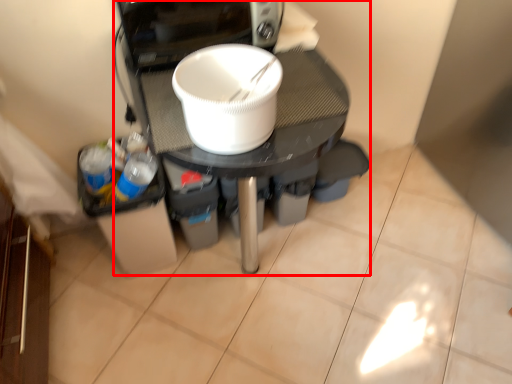
Question: Observing the image, what is the correct spatial positioning of appliance (annotated by the red box) in reference to tableware?

Choices:
 (A) left
 (B) right

Answer: (A)